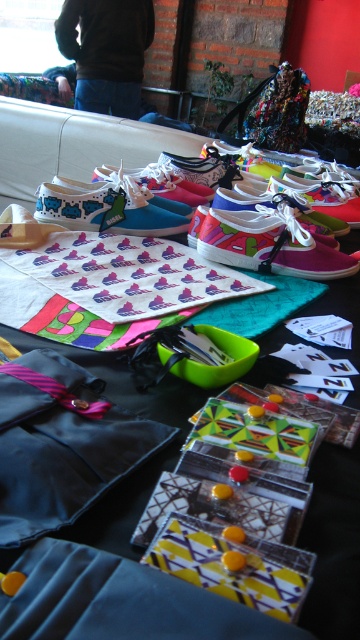
You are setting up a display for a craft fair. You have a matte fabric mat at center and matte pink canvas shoes at center. Which item has a smaller width?

The matte fabric mat at center has a smaller width than the matte pink canvas shoes at center.

What are the coordinates of the matte fabric mat at center?

The coordinates of the matte fabric mat at center are point (110, 285).